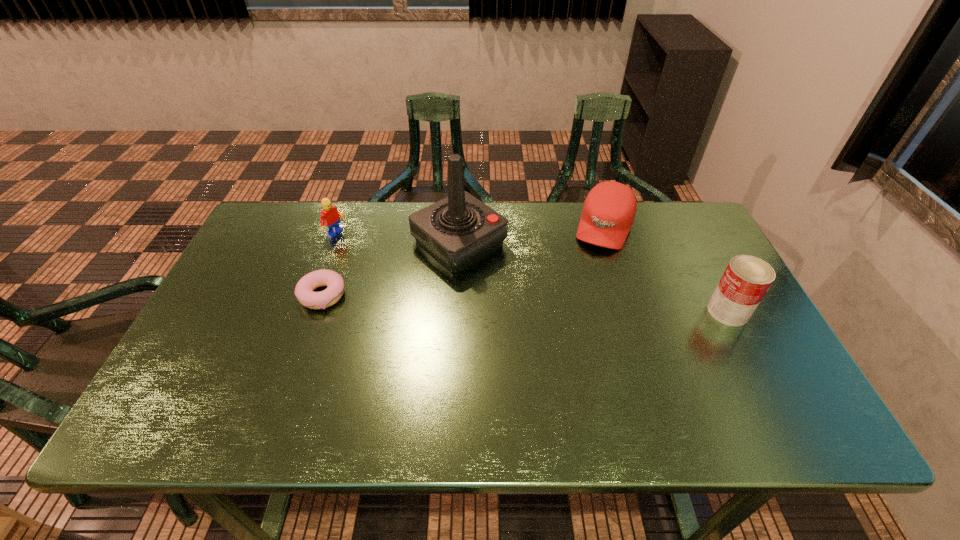
Identify the location of free space between the tallest object and the second tallest object. The height and width of the screenshot is (540, 960). (593, 277).

The width and height of the screenshot is (960, 540). Identify the location of vacant point located between the third object from left to right and the Lego. (398, 239).

Image resolution: width=960 pixels, height=540 pixels. I want to click on vacant space that's between the Lego and the joystick, so click(398, 239).

Identify the location of unoccupied position between the can and the Lego. (533, 273).

This screenshot has height=540, width=960. What are the coordinates of `vacant space that's between the second tallest object and the joystick` in the screenshot? It's located at (593, 277).

Identify which object is the closest to the second tallest object. Please provide its 2D coordinates. Your answer should be formatted as a tuple, i.e. [(x, y)], where the tuple contains the x and y coordinates of a point satisfying the conditions above.

[(608, 213)]

In order to click on the third closest object to the Lego in this screenshot , I will do `click(608, 213)`.

This screenshot has width=960, height=540. What are the coordinates of `vacant space that satisfies the following two spatial constraints: 1. on the back side of the tallest object; 2. on the left side of the second object from right to left` in the screenshot? It's located at (460, 227).

Find the location of a particular element. vacant area that satisfies the following two spatial constraints: 1. on the front side of the Lego; 2. on the left side of the shortest object is located at coordinates (315, 296).